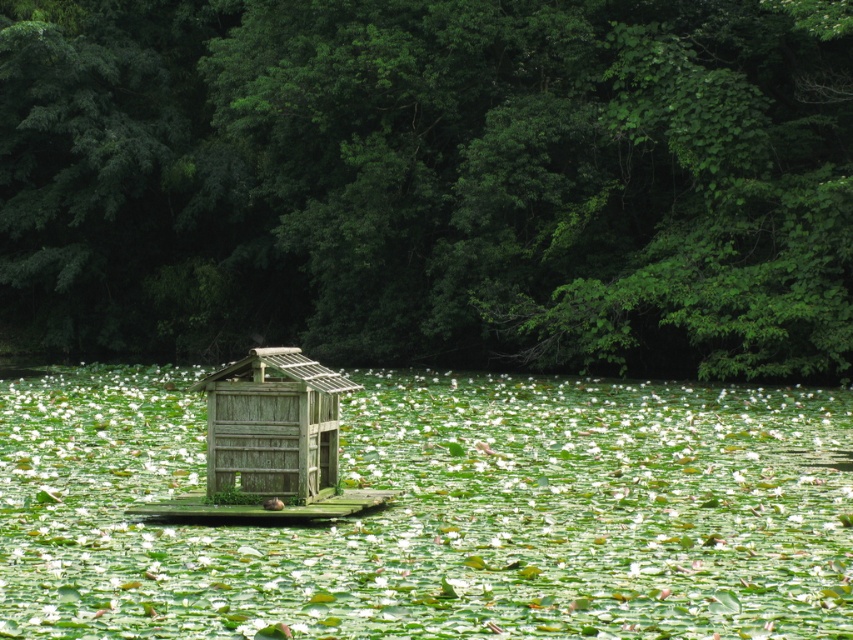
Question: Does green leafy water at center lie in front of weathered wood hut at center?

Choices:
 (A) no
 (B) yes

Answer: (B)

Question: Which point is farther from the camera taking this photo?

Choices:
 (A) (664, 593)
 (B) (315, 413)

Answer: (B)

Question: Is green leafy water at center wider than weathered wood hut at center?

Choices:
 (A) yes
 (B) no

Answer: (A)

Question: Which point is farther to the camera?

Choices:
 (A) green leafy trees at center
 (B) weathered wood hut at center

Answer: (A)

Question: Is green leafy water at center above weathered wood hut at center?

Choices:
 (A) yes
 (B) no

Answer: (B)

Question: Which of the following is the farthest from the observer?

Choices:
 (A) [x=287, y=449]
 (B) [x=630, y=296]

Answer: (B)